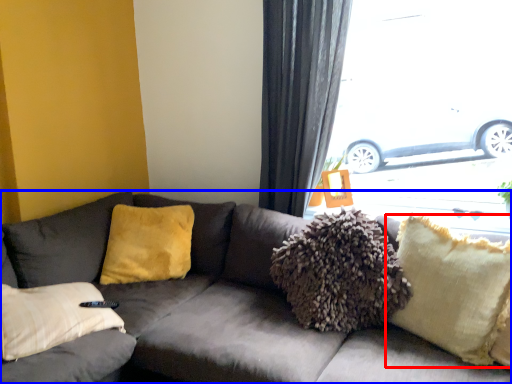
Question: Among these objects, which one is farthest to the camera, pillow (highlighted by a red box) or studio couch (highlighted by a blue box)?

Choices:
 (A) pillow
 (B) studio couch

Answer: (A)